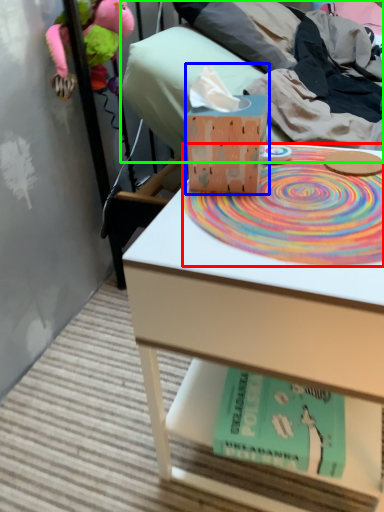
Question: Which object is the closest to the mat (highlighted by a red box)? Choose among these: tissue (highlighted by a blue box) or bed (highlighted by a green box).

Choices:
 (A) tissue
 (B) bed

Answer: (A)